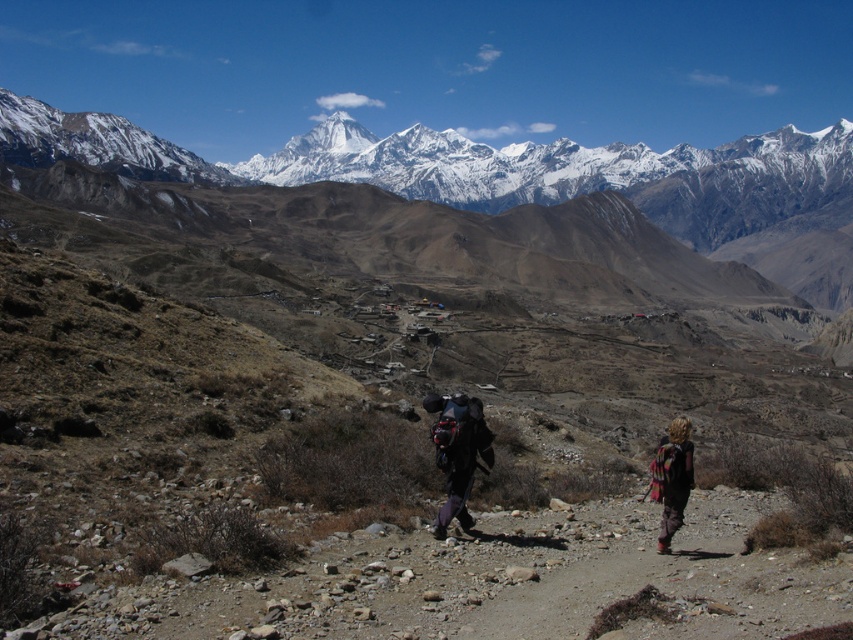
You are a drone operator trying to capture aerial footage of the mountain landscape. You have two points marked on your map, point [448,422] and point [662,538]. If you want to fly the drone closer to the camera position, which point should you prioritize?

Point [448,422] is further to the camera than point [662,538], so to fly closer to the camera position, you should prioritize point [448,422].

You are a hiker who just arrived at the mountain path. You see a dark gray backpack at center and a multicolored woven blanket at lower right. Which item is located to the left of the other?

The dark gray backpack at center is positioned on the left side of multicolored woven blanket at lower right.

You are a drone operator trying to capture a photo of the dark gray backpack at center. The drone is currently at the position of the person on the right. What direction should you move the drone to get closer to the backpack?

The dark gray backpack at center is located at point 0.705 in the x coordinate and 0.538 in the y coordinate. Since the person on the right is not at the same coordinates, the drone should move towards the backpack by adjusting its position based on these coordinates.